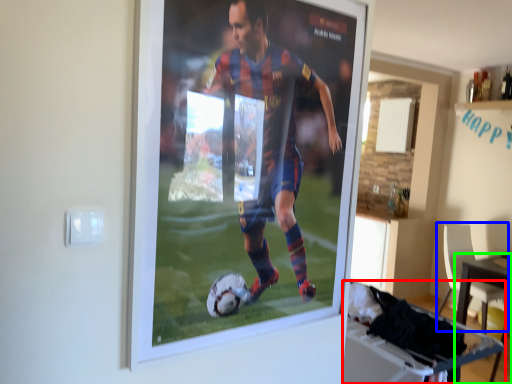
Question: Considering the real-world distances, which object is farthest from table (highlighted by a red box)? chair (highlighted by a blue box) or table (highlighted by a green box)?

Choices:
 (A) chair
 (B) table

Answer: (A)